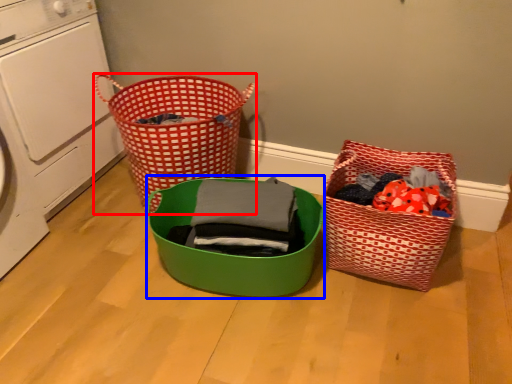
Question: Which object is closer to the camera taking this photo, waste container (highlighted by a red box) or basket (highlighted by a blue box)?

Choices:
 (A) waste container
 (B) basket

Answer: (B)